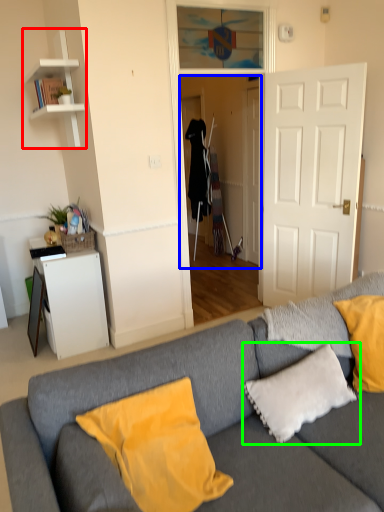
Question: Which is farther away from shelf (highlighted by a red box)? glass door (highlighted by a blue box) or pillow (highlighted by a green box)?

Choices:
 (A) glass door
 (B) pillow

Answer: (B)